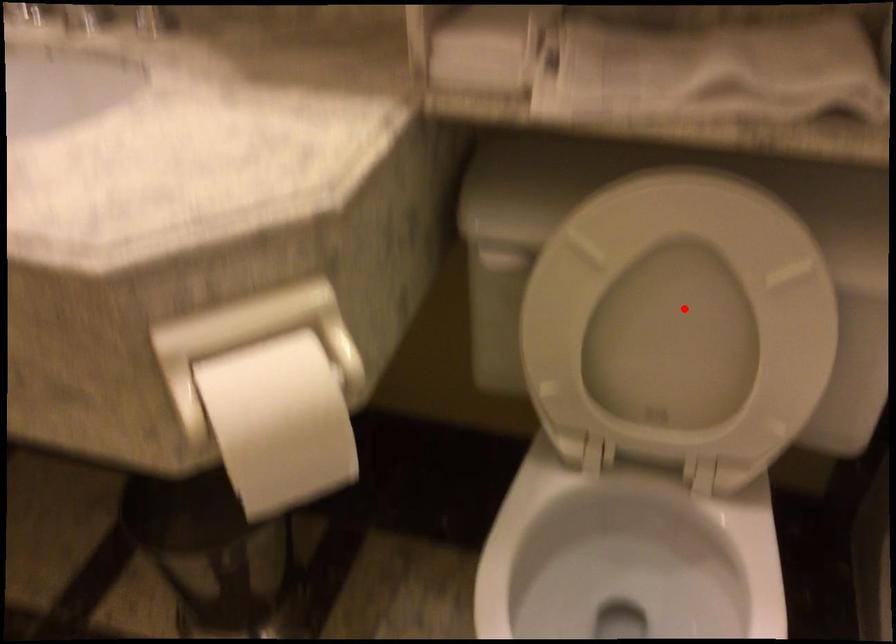
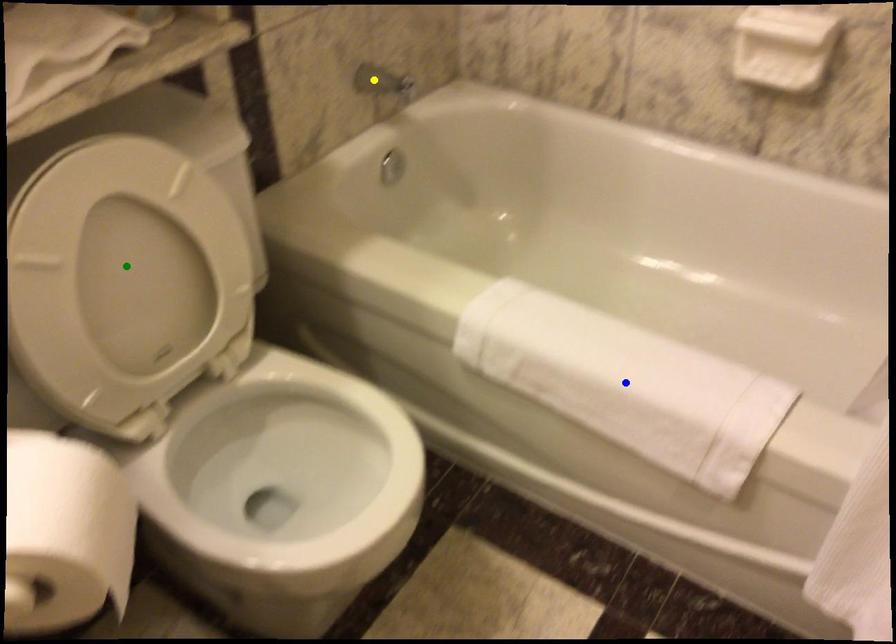
Question: I am providing you with two images of the same scene from different viewpoints. A red point is marked on the first image. You are given multiple points on the second image. Can you choose the point in image 2 that corresponds to the point in image 1?

Choices:
 (A) yellow point
 (B) blue point
 (C) green point

Answer: (C)